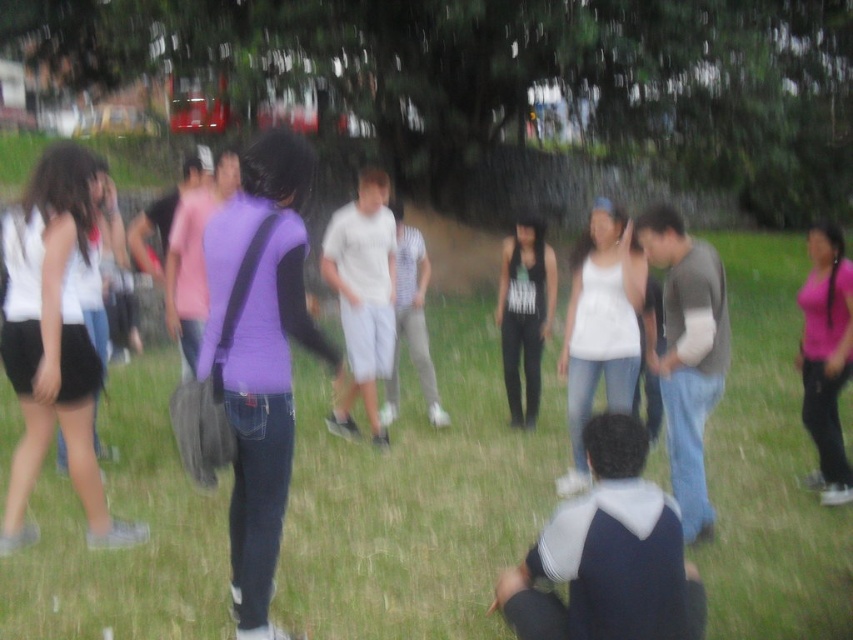
Question: Is matte white tank top at left positioned before pink matte tank top at right?

Choices:
 (A) no
 (B) yes

Answer: (B)

Question: Estimate the real-world distances between objects in this image. Which object is closer to the matte purple shirt at center?

Choices:
 (A) pink matte tank top at right
 (B) white matte tank top at center
 (C) green grass at center

Answer: (B)

Question: Can you confirm if green grass at center is positioned below pink matte tank top at right?

Choices:
 (A) no
 (B) yes

Answer: (B)

Question: Which point is farther from the camera taking this photo?

Choices:
 (A) (238, 202)
 (B) (820, 448)

Answer: (B)

Question: Which point is closer to the camera?

Choices:
 (A) (74, 468)
 (B) (606, 388)

Answer: (A)

Question: Can you confirm if white matte tank top at center is positioned to the left of black matte tank top at center?

Choices:
 (A) yes
 (B) no

Answer: (B)